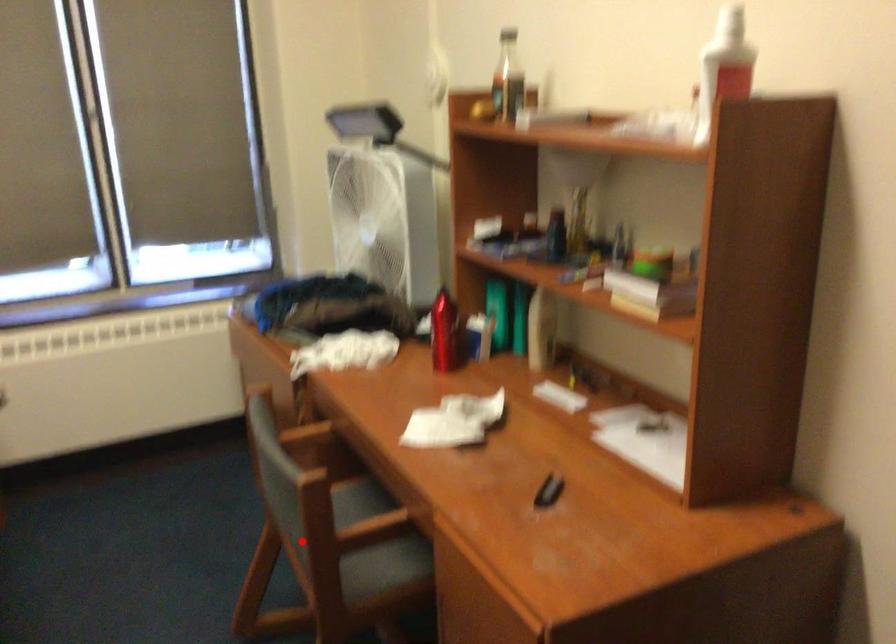
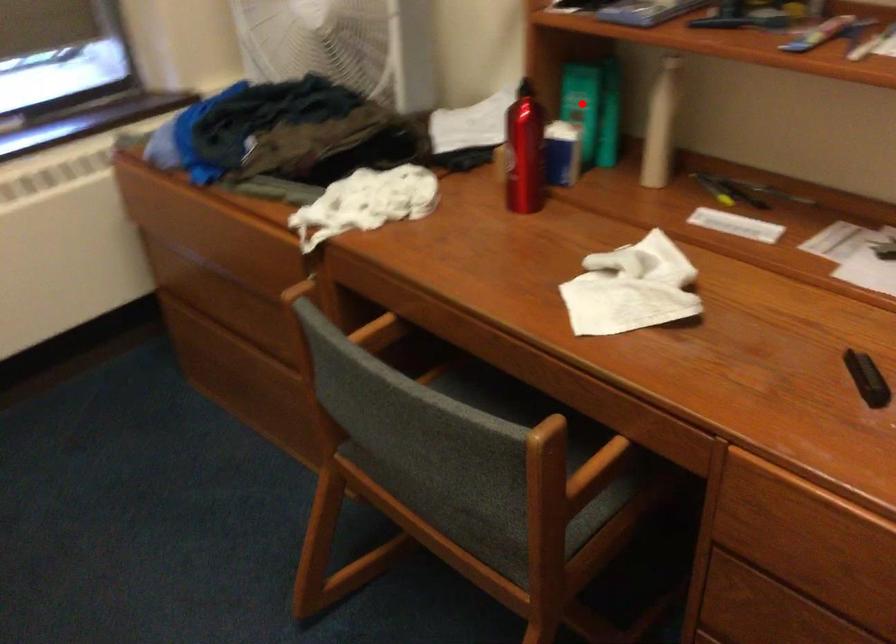
I am providing you with two images of the same scene from different viewpoints. A red point is marked on the first image and another point is marked on the second image. Is the red point in image1 aligned with the point shown in image2?

No